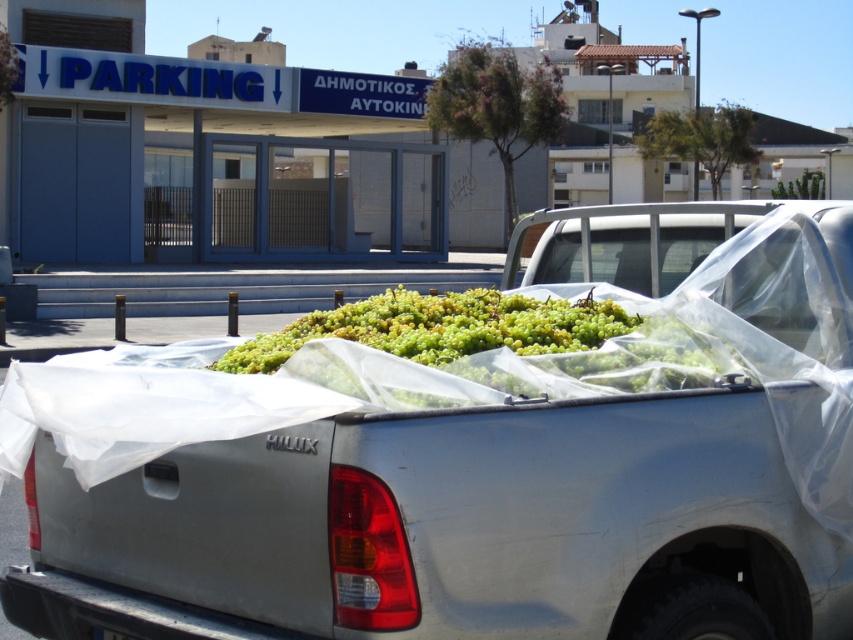
Question: Does white matte truck at center appear under green matte grapes at center?

Choices:
 (A) yes
 (B) no

Answer: (A)

Question: Does white matte truck at center have a lesser width compared to green matte grapes at center?

Choices:
 (A) no
 (B) yes

Answer: (A)

Question: Is the position of white matte truck at center less distant than that of green matte grapes at center?

Choices:
 (A) no
 (B) yes

Answer: (B)

Question: Which of the following is the closest to the observer?

Choices:
 (A) green matte grapes at center
 (B) white matte truck at center

Answer: (B)

Question: Which object appears farthest from the camera in this image?

Choices:
 (A) white matte truck at center
 (B) green matte grapes at center

Answer: (B)